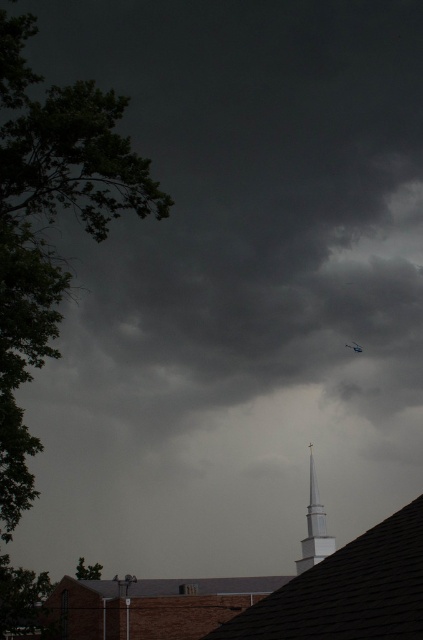
Between white smooth steeple at center and blue metallic plane at upper center, which one has less height?

Standing shorter between the two is blue metallic plane at upper center.

Which is in front, point (310, 493) or point (345, 346)?

Point (310, 493) is in front.

Does point (310, 522) come farther from viewer compared to point (362, 348)?

No.

Locate an element on the screen. This screenshot has height=640, width=423. white smooth steeple at center is located at coordinates [x=313, y=528].